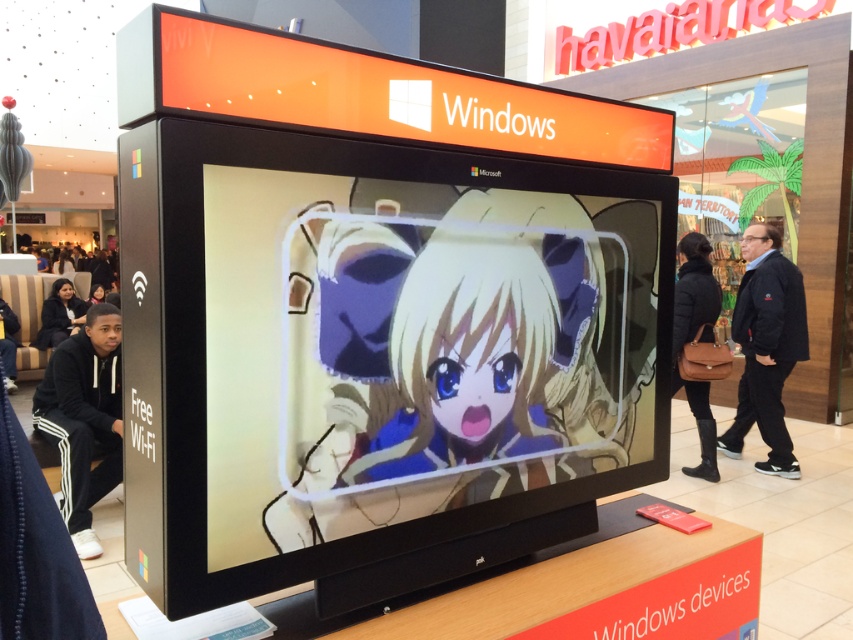
You are standing in front of the Windows promotional display. You see the black fleece pants at lower left and the black leather bag at right. Which object is nearer to you?

The black fleece pants at lower left are closer to the viewer than the black leather bag at right.

You are a customer at a tech store and see the matte black monitor at center and the black hoodie at lower left. Which item is closer to you?

Result: The matte black monitor at center is closer to you than the black hoodie at lower left because it is in front of it.

You are a store employee who needs to place a black leather bag at right on the wooden top of the display stand next to the matte black monitor at center. Given that the monitor is wider than the bag, will the bag fit on the remaining space on the wooden top?

The matte black monitor at center is wider than the black leather bag at right. Since the monitor is already placed on the wooden top, there should be enough remaining space to place the bag next to it as the bag is narrower.